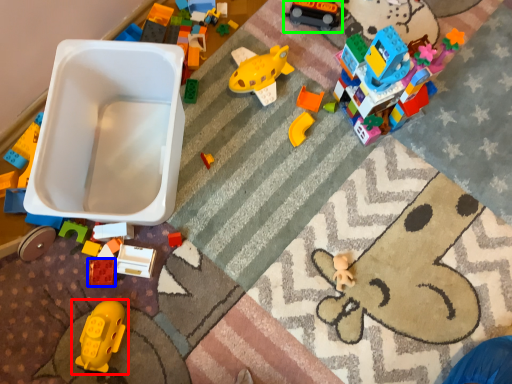
Question: Which object is the closest to the toy (highlighted by a red box)? Choose among these: toy (highlighted by a blue box) or toy (highlighted by a green box).

Choices:
 (A) toy
 (B) toy

Answer: (A)